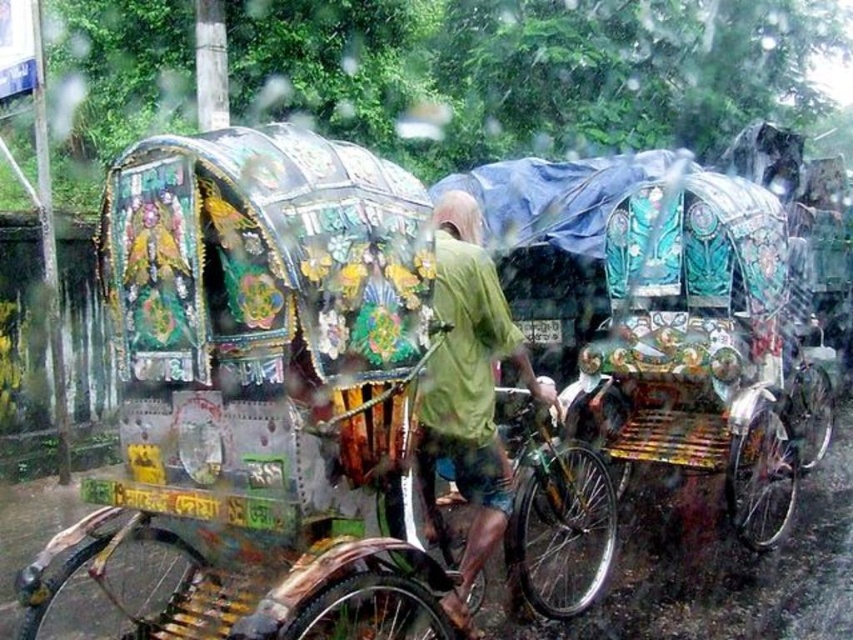
Question: Is green matte shirt at center thinner than metallic silver bicycle at center?

Choices:
 (A) yes
 (B) no

Answer: (A)

Question: Which point is closer to the camera?

Choices:
 (A) (543, 616)
 (B) (825, 449)
 (C) (428, 508)
 (D) (502, 531)

Answer: (C)

Question: Which of the following is the farthest from the observer?

Choices:
 (A) (791, 424)
 (B) (456, 292)
 (C) (587, 513)
 (D) (428, 637)

Answer: (A)

Question: Which of these objects is positioned farthest from the shiny metallic bicycle at center?

Choices:
 (A) green matte shirt at center
 (B) decorative painted rickshaw at left

Answer: (A)

Question: Does decorative painted rickshaw at left appear on the right side of metallic silver bicycle at center?

Choices:
 (A) yes
 (B) no

Answer: (B)

Question: Does green matte shirt at center appear on the right side of metallic silver bicycle at center?

Choices:
 (A) no
 (B) yes

Answer: (A)